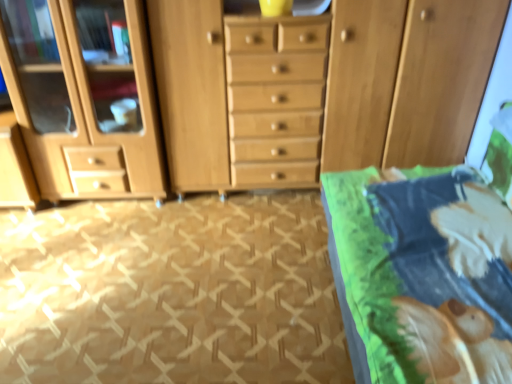
What are the coordinates of `free space above beige carpet at lower left (from a real-world perspective)` in the screenshot? It's located at (157, 258).